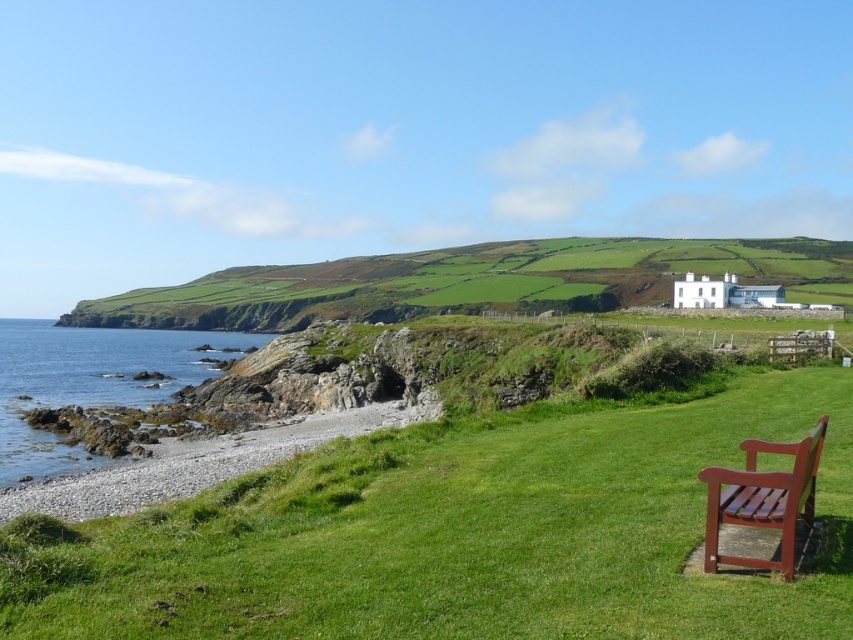
You are planning to place a small garden statue that requires a 2x2 feet area. Looking at the image, can the green grassy at lower right and the mahogany wood bench at lower right accommodate this statue?

The green grassy at lower right might be wider than the mahogany wood bench at lower right, so it could potentially accommodate the statue if the grassy area is sufficiently wide. However, the bench itself is likely too narrow to fit the statue.

You are planning to set up a small picnic area in the coastal landscape. The picnic blanket needs to be placed on a surface that is taller than the other. Which location between the green grassy at lower right and smooth pebbles at lower left should you choose?

The smooth pebbles at lower left are taller than the green grassy at lower right, so you should place the picnic blanket on the smooth pebbles at lower left.

You are a painter setting up your easel to capture the coastal landscape. You want to ensure the green grassy at lower right and the mahogany wood bench at lower right are both visible in your painting. Given their heights, which object should you place closer to the foreground to maintain their visibility?

The green grassy at lower right has a greater height compared to the mahogany wood bench at lower right, so to ensure both are visible, you should place the green grassy at lower right closer to the foreground since its height will help it stand out against the background.